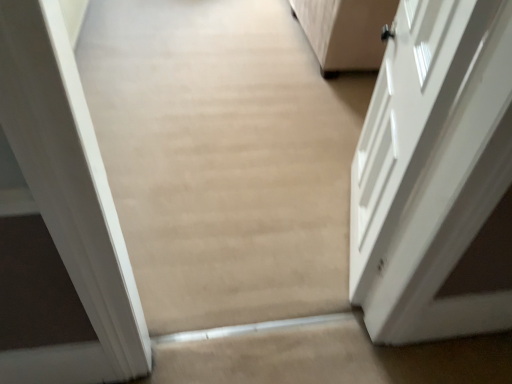
Where is `beige carpet at center`? The width and height of the screenshot is (512, 384). beige carpet at center is located at coordinates (223, 158).

In order to face beige carpet at center, should I rotate leftwards or rightwards?

You should rotate right by 5.262 degrees.

Image resolution: width=512 pixels, height=384 pixels. Describe the element at coordinates (223, 158) in the screenshot. I see `beige carpet at center` at that location.

Find the location of `white glossy door at right`. white glossy door at right is located at coordinates (435, 174).

Describe the element at coordinates (435, 174) in the screenshot. I see `white glossy door at right` at that location.

What is the approximate height of white glossy door at right?

3.83 feet.

In order to face white glossy door at right, should I rotate leftwards or rightwards?

Turn right approximately 17.598 degrees to face it.

This screenshot has width=512, height=384. I want to click on beige carpet at center, so click(x=223, y=158).

Which object is positioned more to the right, white glossy door at right or beige carpet at center?

Positioned to the right is white glossy door at right.

Is the depth of white glossy door at right greater than that of beige carpet at center?

Yes, it is.

Is point (483, 312) positioned in front of point (253, 101)?

That is True.

From the image's perspective, is white glossy door at right above or below beige carpet at center?

white glossy door at right is situated higher than beige carpet at center in the image.

From a real-world perspective, is white glossy door at right below beige carpet at center?

Yes, from a real-world perspective, white glossy door at right is beneath beige carpet at center.

Is white glossy door at right wider than beige carpet at center?

Indeed, white glossy door at right has a greater width compared to beige carpet at center.

Considering the relative sizes of white glossy door at right and beige carpet at center in the image provided, is white glossy door at right shorter than beige carpet at center?

Indeed, white glossy door at right has a lesser height compared to beige carpet at center.

Which of these two, white glossy door at right or beige carpet at center, is smaller?

beige carpet at center.

Would you say white glossy door at right contains beige carpet at center?

No, beige carpet at center is not surrounded by white glossy door at right.

Are white glossy door at right and beige carpet at center far apart?

No, white glossy door at right is in close proximity to beige carpet at center.

Does white glossy door at right turn towards beige carpet at center?

No, white glossy door at right is not aimed at beige carpet at center.

What's the angular difference between white glossy door at right and beige carpet at center's facing directions?

The angle between the facing direction of white glossy door at right and the facing direction of beige carpet at center is 72.4 degrees.

Find the location of a particular element. door above the beige carpet at center (from the image's perspective) is located at coordinates (435, 174).

Would you say beige carpet at center is to the left or to the right of white glossy door at right in the picture?

From the image, it's evident that beige carpet at center is to the left of white glossy door at right.

Which object is closer to the camera taking this photo, beige carpet at center or white glossy door at right?

Positioned in front is beige carpet at center.

In the scene shown: Which is closer to the camera, (209, 230) or (500, 105)?

The point (500, 105) is in front.

From the image's perspective, between beige carpet at center and white glossy door at right, which one is located above?

From the image's view, white glossy door at right is above.

From a real-world perspective, is beige carpet at center physically located above or below white glossy door at right?

beige carpet at center is situated higher than white glossy door at right in the real world.

Between beige carpet at center and white glossy door at right, which one has larger width?

white glossy door at right is wider.

Which of these two, beige carpet at center or white glossy door at right, stands shorter?

Standing shorter between the two is white glossy door at right.

Is beige carpet at center smaller than white glossy door at right?

Indeed, beige carpet at center has a smaller size compared to white glossy door at right.

Would you say beige carpet at center is outside white glossy door at right?

beige carpet at center lies outside white glossy door at right's area.

Is there a large distance between beige carpet at center and white glossy door at right?

No, beige carpet at center is in close proximity to white glossy door at right.

Is beige carpet at center aimed at white glossy door at right?

Yes, beige carpet at center is turned towards white glossy door at right.

What's the angular difference between beige carpet at center and white glossy door at right's facing directions?

There is a 72.4-degree angle between the facing directions of beige carpet at center and white glossy door at right.

Locate an element on the screen. door above the beige carpet at center (from the image's perspective) is located at coordinates click(x=435, y=174).

This screenshot has height=384, width=512. Find the location of `plain below the white glossy door at right (from the image's perspective)`. plain below the white glossy door at right (from the image's perspective) is located at coordinates (223, 158).

Identify the location of plain above the white glossy door at right (from a real-world perspective). (223, 158).